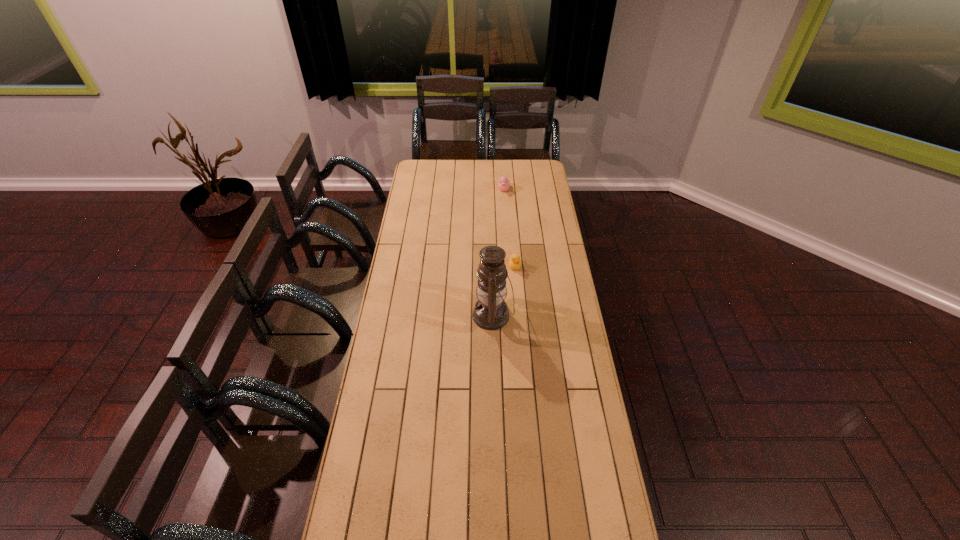
Find the location of `free space that is in between the second farthest object and the farther duckling`. free space that is in between the second farthest object and the farther duckling is located at coordinates (509, 228).

The height and width of the screenshot is (540, 960). Identify the location of empty space that is in between the nearer duckling and the farthest object. (509, 228).

Where is `free space between the farthest object and the second nearest object`? This screenshot has width=960, height=540. free space between the farthest object and the second nearest object is located at coordinates (509, 228).

In order to click on free space between the second nearest object and the farther duckling in this screenshot , I will do `click(509, 228)`.

This screenshot has width=960, height=540. Find the location of `object that can be found as the second closest to the farther duckling`. object that can be found as the second closest to the farther duckling is located at coordinates (491, 312).

Where is `object that stands as the closest to the oil lamp`? The image size is (960, 540). object that stands as the closest to the oil lamp is located at coordinates (514, 262).